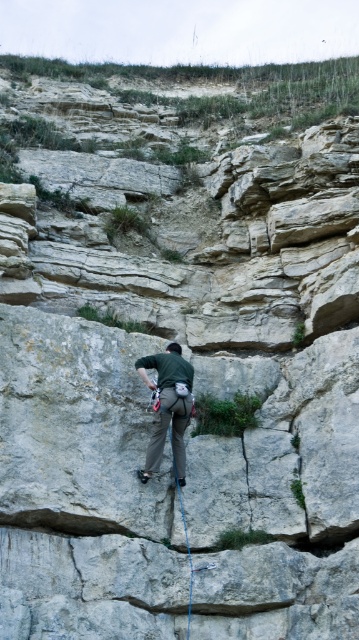
You are a rock climber looking at the cliff face. You see the green fabric climbing harness at center and the blue nylon rope at center. Which object is positioned more to the left?

The green fabric climbing harness at center is positioned to the left of the blue nylon rope at center.

You are a rock climber looking at the cliff face. You notice the green fabric climbing harness at center and the blue nylon rope at center. Which object is closer to you?

The green fabric climbing harness at center is closer to you than the blue nylon rope at center.

You are a safety inspector reviewing a rock climbing site. You observe the green fabric climbing harness at center. Based on safety standards, the maximum recommended distance between the climber and the harness is 2 meters. Is the current distance compliant with safety regulations?

The green fabric climbing harness at center is 68.11 meters away from the camera, which is far beyond the recommended maximum distance of 2 meters. This does not comply with safety regulations.